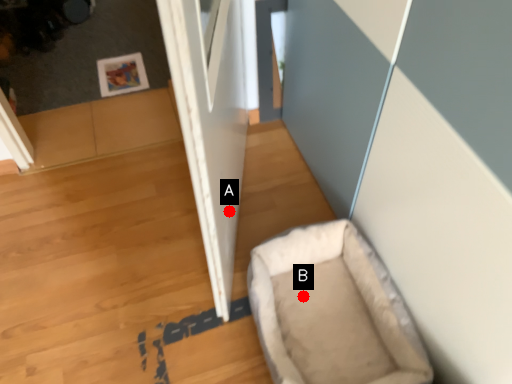
Question: Two points are circled on the image, labeled by A and B beside each circle. Which point is closer to the camera taking this photo?

Choices:
 (A) A is closer
 (B) B is closer

Answer: (A)